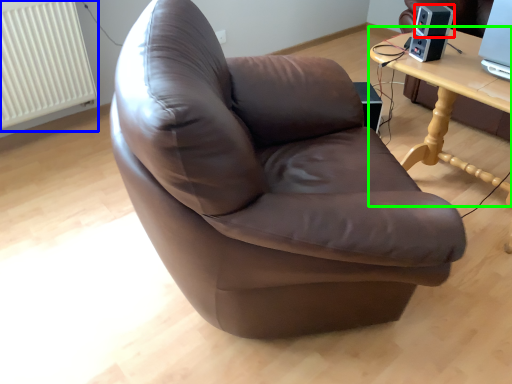
Question: Which object is the farthest from speaker (highlighted by a red box)? Choose among these: radiator (highlighted by a blue box) or table (highlighted by a green box).

Choices:
 (A) radiator
 (B) table

Answer: (A)